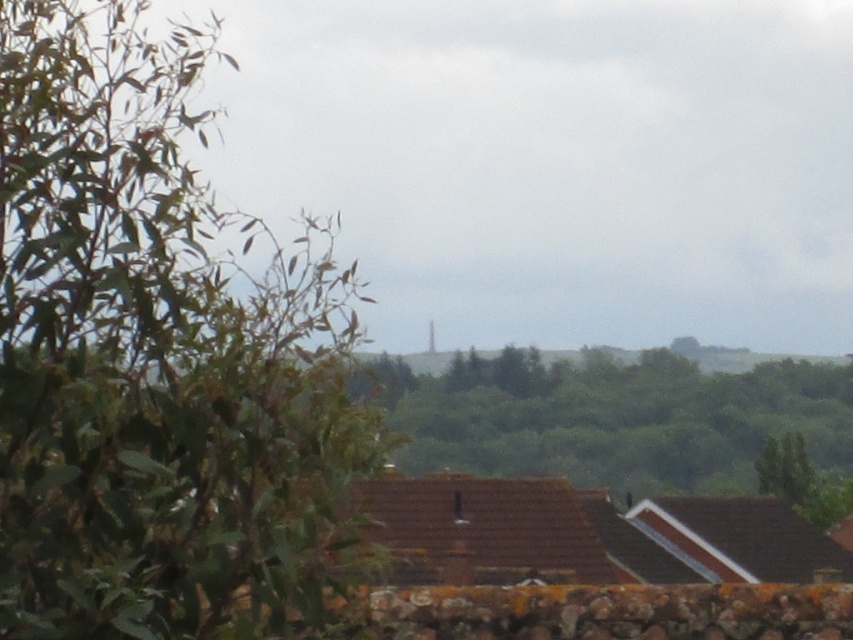
You are standing in the middle of the landscape and want to take a photo of the green leafy tree at left and the green leafy tree at center. Which tree should you focus on first if you want to capture both in the same frame without moving your camera?

The green leafy tree at left is taller than the green leafy tree at center, so you should focus on the green leafy tree at left first to ensure both are in the frame.

You are standing at the point marked by the coordinates point (613,419). Looking around, what do you see directly in front of you?

The point (613,419) marks green leafy tree at center, so you would see the green leafy tree at center directly in front of you.